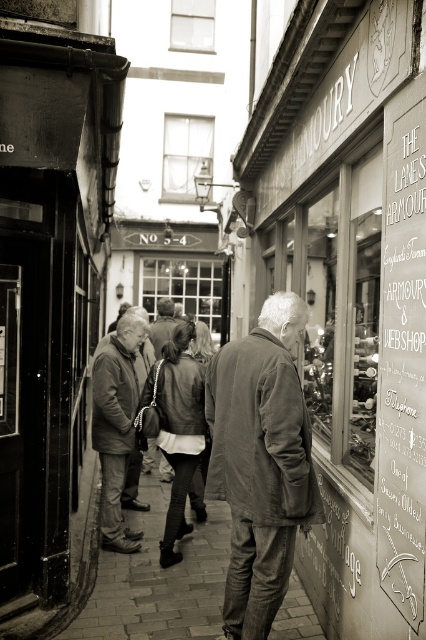
Is matte wooden signboard at center closer to camera compared to leather jacket at center?

Yes, matte wooden signboard at center is closer to the viewer.

Does point (402, 154) come farther from viewer compared to point (166, 310)?

No, (402, 154) is in front of (166, 310).

Is point (319, 129) closer to camera compared to point (172, 307)?

Yes, it is.

Where is `matte wooden signboard at center`? matte wooden signboard at center is located at coordinates (348, 282).

Which is more to the right, matte brown jacket at center or leather jacket at center?

matte brown jacket at center

Which of these two, matte brown jacket at center or leather jacket at center, stands taller?

Standing taller between the two is matte brown jacket at center.

What are the coordinates of `matte brown jacket at center` in the screenshot? It's located at tap(115, 424).

At what (x,y) coordinates should I click in order to perform the action: click on matte brown jacket at center. Please return your answer as a coordinate pair (x, y). Image resolution: width=426 pixels, height=640 pixels. Looking at the image, I should click on (115, 424).

Measure the distance from matte gray jacket at center to white chalkboard sign at right.

matte gray jacket at center is 32.31 inches from white chalkboard sign at right.

Based on the photo, between matte gray jacket at center and white chalkboard sign at right, which one has less height?

matte gray jacket at center is shorter.

Who is more distant from viewer, (252,616) or (385,380)?

Positioned behind is point (252,616).

Image resolution: width=426 pixels, height=640 pixels. In order to click on matte gray jacket at center in this screenshot , I will do `click(261, 461)`.